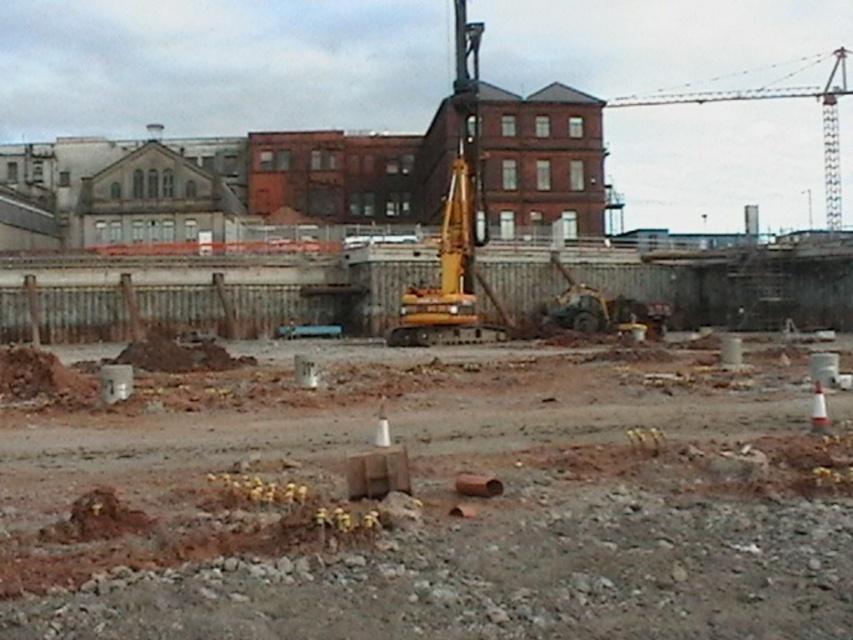
You are a construction worker who needs to place a new safety sign on the ground between the brown gravel at center and the yellow rubber excavator at center. Based on their positions, where should you place the sign so it is visible to both workers near the gravel and those operating the excavator?

The brown gravel at center is located below the yellow rubber excavator at center, so placing the safety sign between them at the center would ensure visibility for both workers near the gravel and the excavator operator.

You are a construction worker needing to transport a large piece of equipment that is 10 meters wide. You have to choose between the yellow rubber excavator at center and the yellow metallic crane at upper right. Which one can accommodate the equipment based on their widths?

The yellow metallic crane at upper right has a greater width than the yellow rubber excavator at center, so it can accommodate the 10 meters wide equipment.

You are a construction worker who needs to move a heavy tool from the brown gravel at center to the yellow rubber excavator at center. Which direction should you move the tool to reach the excavator?

The brown gravel at center is positioned on the left side of the yellow rubber excavator at center, so you should move the tool to the right to reach the excavator.